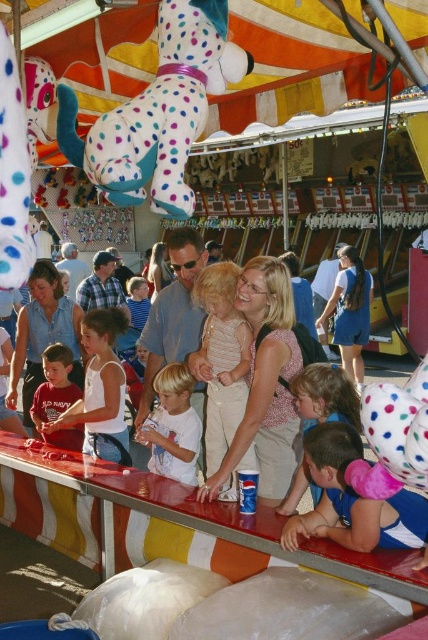
Is white cotton shirt at center to the left of denim shirt at center from the viewer's perspective?

Incorrect, white cotton shirt at center is not on the left side of denim shirt at center.

Which is above, white cotton shirt at center or denim shirt at center?

white cotton shirt at center is above.

Does point (106, 404) come in front of point (42, 349)?

Yes, it is in front of point (42, 349).

I want to click on white cotton shirt at center, so click(x=101, y=390).

Does white cotton shirt at center have a lesser width compared to matte white shirt at center?

No, white cotton shirt at center is not thinner than matte white shirt at center.

From the picture: Is white cotton shirt at center in front of matte white shirt at center?

Yes, white cotton shirt at center is in front of matte white shirt at center.

In the scene shown: Who is more distant from viewer, (85, 339) or (35, 412)?

The point (35, 412) is more distant.

You are a GUI agent. You are given a task and a screenshot of the screen. Output one action in this format:
    pyautogui.click(x=<x>, y=<y>)
    Task: Click on the white cotton shirt at center
    Image resolution: width=428 pixels, height=640 pixels.
    Given the screenshot: What is the action you would take?
    pyautogui.click(x=101, y=390)

Can you confirm if light brown hair at center is bigger than matte white shirt at center?

No, light brown hair at center is not bigger than matte white shirt at center.

What do you see at coordinates (172, 426) in the screenshot? I see `light brown hair at center` at bounding box center [172, 426].

Find the location of a particular element. This screenshot has width=428, height=640. light brown hair at center is located at coordinates (172, 426).